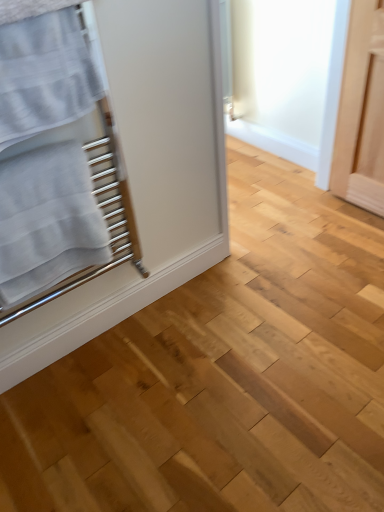
Question: Is white textured towel at left, acting as the second bath towel starting from the top, further to the viewer compared to white textured towel at left, the 1th bath towel in the top-to-bottom sequence?

Choices:
 (A) no
 (B) yes

Answer: (B)

Question: Is there a large distance between white textured towel at left, acting as the second bath towel starting from the top, and white textured towel at left, which is the second bath towel in bottom-to-top order?

Choices:
 (A) yes
 (B) no

Answer: (B)

Question: Can you confirm if white textured towel at left, acting as the second bath towel starting from the top, is bigger than white textured towel at left, which is the second bath towel in bottom-to-top order?

Choices:
 (A) no
 (B) yes

Answer: (B)

Question: From the image's perspective, is white textured towel at left, acting as the second bath towel starting from the top, under white textured towel at left, the 1th bath towel in the top-to-bottom sequence?

Choices:
 (A) yes
 (B) no

Answer: (A)

Question: Considering the relative sizes of white textured towel at left, acting as the second bath towel starting from the top, and white textured towel at left, which is the second bath towel in bottom-to-top order, in the image provided, is white textured towel at left, acting as the second bath towel starting from the top, thinner than white textured towel at left, which is the second bath towel in bottom-to-top order,?

Choices:
 (A) no
 (B) yes

Answer: (A)

Question: Does white textured towel at left, acting as the first bath towel starting from the bottom, appear on the left side of white textured towel at left, the 1th bath towel in the top-to-bottom sequence?

Choices:
 (A) yes
 (B) no

Answer: (A)

Question: Does white textured towel at left, the 1th bath towel in the top-to-bottom sequence, have a lesser width compared to white textured towel at left, acting as the first bath towel starting from the bottom?

Choices:
 (A) no
 (B) yes

Answer: (B)

Question: Is white textured towel at left, the 1th bath towel in the top-to-bottom sequence, outside white textured towel at left, acting as the first bath towel starting from the bottom?

Choices:
 (A) yes
 (B) no

Answer: (A)

Question: Does white textured towel at left, which is the second bath towel in bottom-to-top order, have a lesser height compared to white textured towel at left, acting as the second bath towel starting from the top?

Choices:
 (A) yes
 (B) no

Answer: (A)

Question: Is white textured towel at left, which is the second bath towel in bottom-to-top order, to the left of white textured towel at left, acting as the first bath towel starting from the bottom, from the viewer's perspective?

Choices:
 (A) yes
 (B) no

Answer: (B)

Question: Does white textured towel at left, which is the second bath towel in bottom-to-top order, appear on the right side of white textured towel at left, acting as the first bath towel starting from the bottom?

Choices:
 (A) no
 (B) yes

Answer: (B)

Question: Does white textured towel at left, the 1th bath towel in the top-to-bottom sequence, come in front of white textured towel at left, acting as the first bath towel starting from the bottom?

Choices:
 (A) yes
 (B) no

Answer: (A)

Question: From a real-world perspective, relative to white textured towel at left, acting as the second bath towel starting from the top, is white textured towel at left, which is the second bath towel in bottom-to-top order, vertically above or below?

Choices:
 (A) below
 (B) above

Answer: (B)